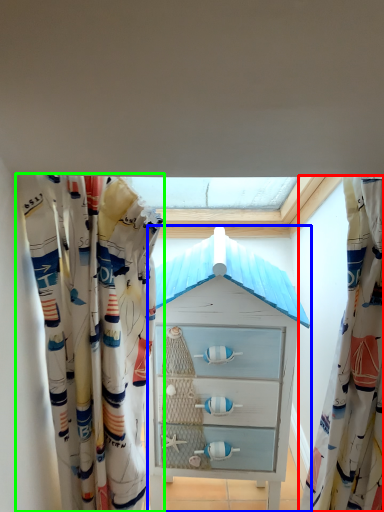
Question: Which is nearer to the curtain (highlighted by a red box)? chest of drawers (highlighted by a blue box) or curtain (highlighted by a green box).

Choices:
 (A) chest of drawers
 (B) curtain

Answer: (A)